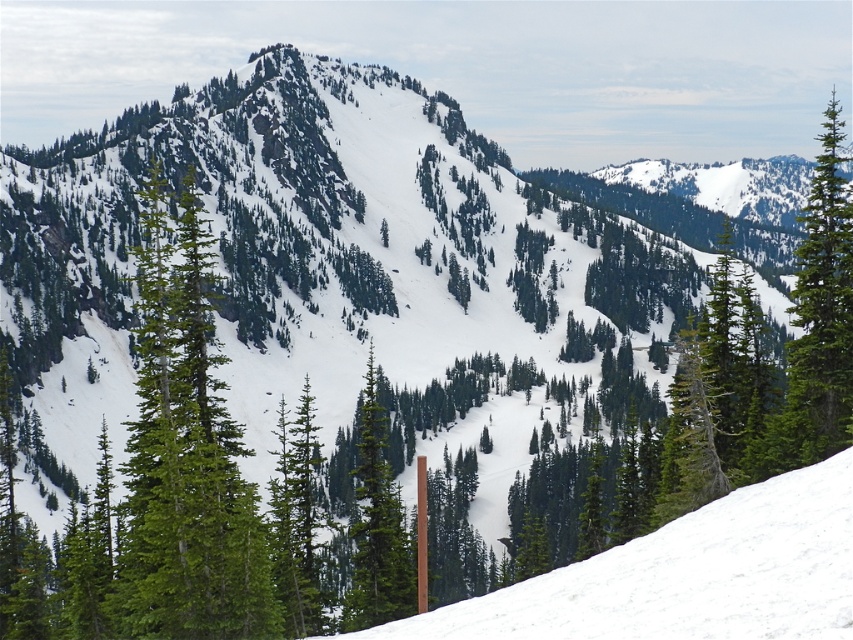
You are an outdoor photographer planning to take a photo of the green matte tree at center and the green matte tree at right. From your current position, which tree should you focus on first to ensure both are in frame?

The green matte tree at center is to the left of green matte tree at right, so you should focus on the green matte tree at center first to ensure both are in frame.

From the picture: You are a hiker planning to walk from the wooden post in the middle ground to the green matte tree at center. How far apart are these two landmarks?

The wooden post in the middle ground and the green matte tree at center are 56.68 meters apart.